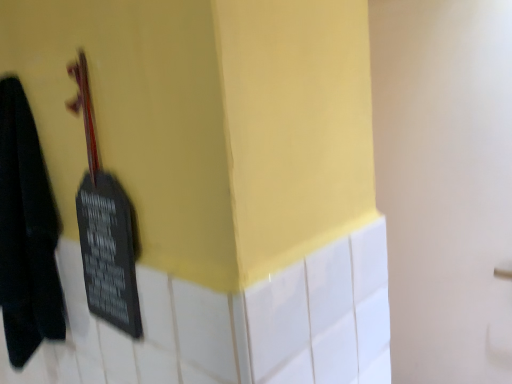
Question: In terms of size, does black matte towel at left appear bigger or smaller than black matte violin at left?

Choices:
 (A) big
 (B) small

Answer: (A)

Question: Does point (56, 319) appear closer or farther from the camera than point (112, 261)?

Choices:
 (A) farther
 (B) closer

Answer: (A)

Question: Is black matte towel at left taller or shorter than black matte violin at left?

Choices:
 (A) short
 (B) tall

Answer: (B)

Question: Relative to black matte towel at left, is black matte violin at left in front or behind?

Choices:
 (A) behind
 (B) front

Answer: (B)

Question: From the image's perspective, relative to black matte towel at left, is black matte violin at left above or below?

Choices:
 (A) below
 (B) above

Answer: (B)

Question: Choose the correct answer: Is black matte violin at left inside black matte towel at left or outside it?

Choices:
 (A) inside
 (B) outside

Answer: (B)

Question: From a real-world perspective, is black matte violin at left positioned above or below black matte towel at left?

Choices:
 (A) above
 (B) below

Answer: (A)